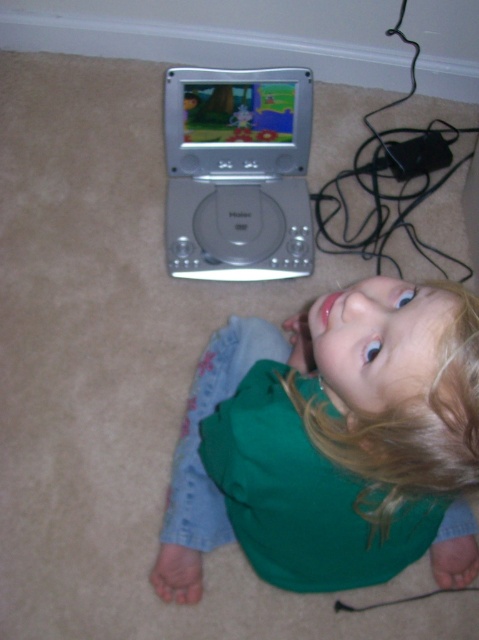
Question: From the image, what is the correct spatial relationship of green fabric shirt at lower center in relation to silver metallic dvd player at upper center?

Choices:
 (A) left
 (B) right

Answer: (B)

Question: Which point is farther to the camera?

Choices:
 (A) (262, 193)
 (B) (282, 125)
 (C) (281, 456)

Answer: (A)

Question: Is silver metallic dvd player at upper center wider than silver metallic portable dvd player at upper center?

Choices:
 (A) yes
 (B) no

Answer: (B)

Question: Is silver metallic dvd player at upper center bigger than silver metallic portable dvd player at upper center?

Choices:
 (A) no
 (B) yes

Answer: (B)

Question: Among these objects, which one is nearest to the camera?

Choices:
 (A) silver metallic portable dvd player at upper center
 (B) green fabric shirt at lower center
 (C) silver metallic dvd player at upper center

Answer: (B)

Question: Which point is closer to the camera?

Choices:
 (A) (260, 232)
 (B) (321, 396)

Answer: (B)